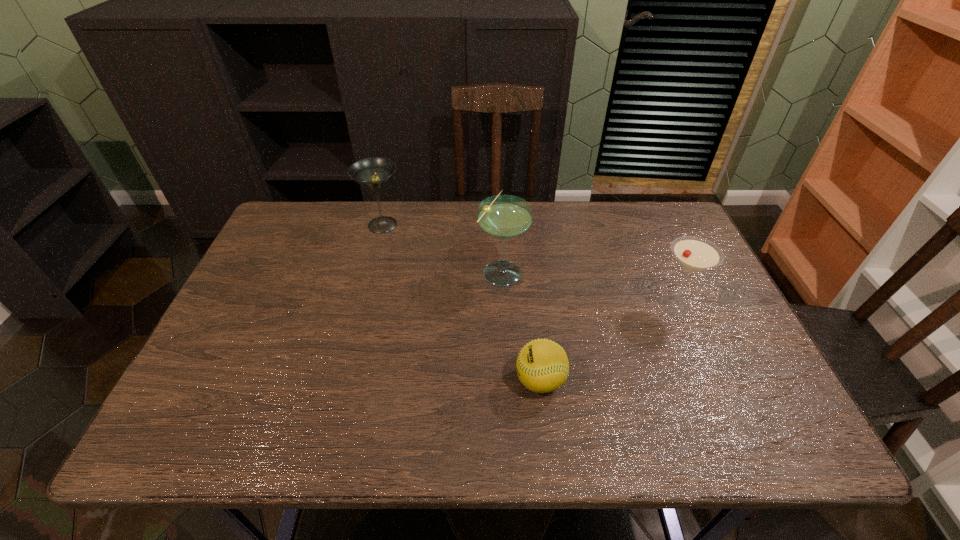
Identify the location of the leftmost martini. The image size is (960, 540). click(x=373, y=173).

The height and width of the screenshot is (540, 960). What are the coordinates of `the farthest martini` in the screenshot? It's located at (373, 173).

You are a GUI agent. You are given a task and a screenshot of the screen. Output one action in this format:
    pyautogui.click(x=<x>, y=<y>)
    Task: Click on the second martini from right to left
    
    Given the screenshot: What is the action you would take?
    pyautogui.click(x=504, y=217)

The height and width of the screenshot is (540, 960). I want to click on the rightmost object, so click(x=694, y=254).

Identify the location of the rightmost martini. This screenshot has height=540, width=960. (694, 254).

The width and height of the screenshot is (960, 540). What are the coordinates of `the nearest object` in the screenshot? It's located at (542, 366).

You are a GUI agent. You are given a task and a screenshot of the screen. Output one action in this format:
    pyautogui.click(x=<x>, y=<y>)
    Task: Click on the shortest object
    
    Given the screenshot: What is the action you would take?
    pyautogui.click(x=542, y=366)

The image size is (960, 540). In order to click on vacant region located on the right of the leftmost martini in this screenshot , I will do `click(455, 225)`.

Where is `vacant space located on the front of the second martini from right to left`? The image size is (960, 540). vacant space located on the front of the second martini from right to left is located at coordinates (507, 370).

Where is `free space located 0.300m on the left of the shortest martini`? The width and height of the screenshot is (960, 540). free space located 0.300m on the left of the shortest martini is located at coordinates (538, 305).